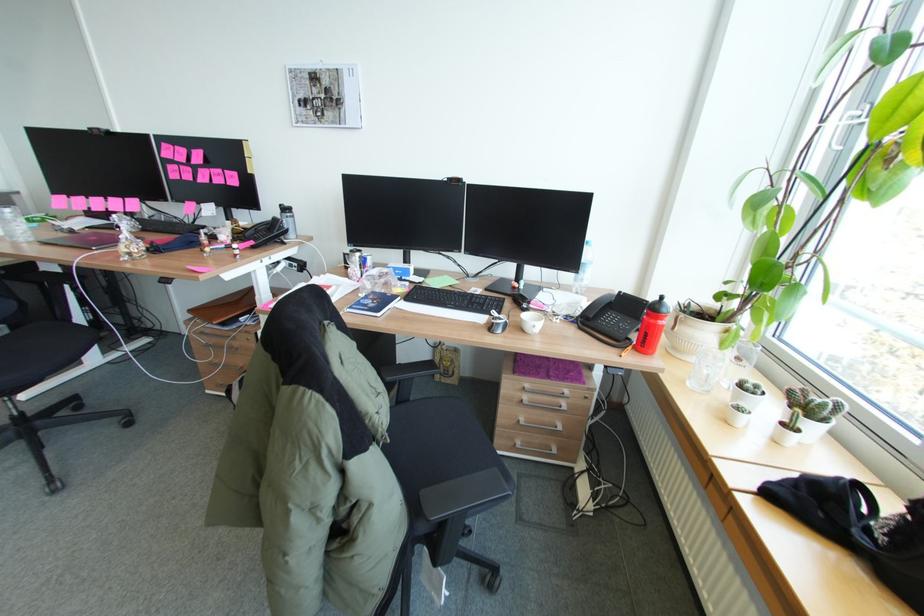
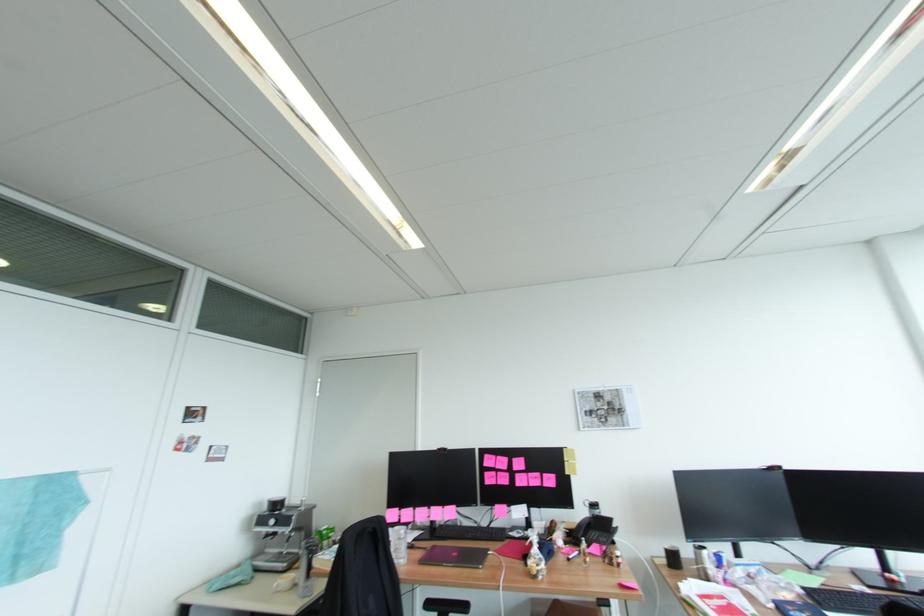
In the second image, find the point that corresponds to (x=169, y=146) in the first image.

(492, 456)